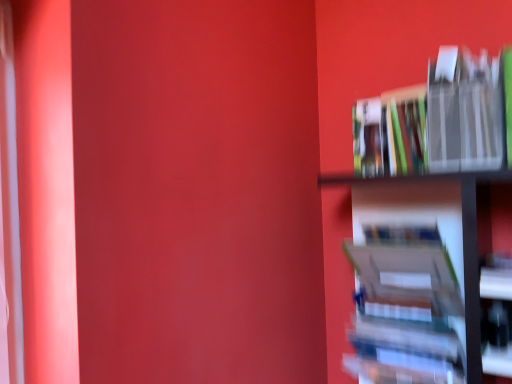
At what (x,y) coordinates should I click in order to perform the action: click on metallic silver book at right, placed as the third book when sorted from bottom to top. Please return your answer as a coordinate pair (x, y). Looking at the image, I should click on (439, 120).

Who is taller, hardcover book at right, which appears as the 1th book when ordered from the bottom, or metallic silver book at right, placed as the third book when sorted from bottom to top?

hardcover book at right, which appears as the 1th book when ordered from the bottom, is taller.

Measure the distance between hardcover book at right, the 3th book from the top, and metallic silver book at right, placed as the third book when sorted from bottom to top.

The distance of hardcover book at right, the 3th book from the top, from metallic silver book at right, placed as the third book when sorted from bottom to top, is 28.44 centimeters.

From a real-world perspective, who is located lower, hardcover book at right, which appears as the 1th book when ordered from the bottom, or metallic silver book at right, acting as the first book starting from the top?

hardcover book at right, which appears as the 1th book when ordered from the bottom, is physically lower.

Considering the points (440, 203) and (362, 142), which point is behind, point (440, 203) or point (362, 142)?

Point (440, 203)

Which book is the 2nd one when counting from the right side of the hardcover book at right, the 3th book from the top? Please provide its 2D coordinates.

[(439, 120)]

Does metallic silver book at right, placed as the third book when sorted from bottom to top, turn towards hardcover book at right, which appears as the 1th book when ordered from the bottom?

No, metallic silver book at right, placed as the third book when sorted from bottom to top, does not turn towards hardcover book at right, which appears as the 1th book when ordered from the bottom.

Does metallic silver book at right, placed as the third book when sorted from bottom to top, have a lesser width compared to hardcover book at right, which appears as the 1th book when ordered from the bottom?

No.

From the image's perspective, which one is positioned lower, hardcover book at right, which appears as the 1th book when ordered from the bottom, or hardcover book at upper right, the 2th book when ordered from bottom to top?

hardcover book at right, which appears as the 1th book when ordered from the bottom, from the image's perspective.

Does point (443, 308) come closer to viewer compared to point (381, 162)?

That is True.

Does hardcover book at right, which appears as the 1th book when ordered from the bottom, contain hardcover book at upper right, placed as the 2th book when sorted from top to bottom?

No, hardcover book at upper right, placed as the 2th book when sorted from top to bottom, is not surrounded by hardcover book at right, which appears as the 1th book when ordered from the bottom.

Relative to hardcover book at upper right, the 2th book when ordered from bottom to top, is hardcover book at right, which appears as the 1th book when ordered from the bottom, in front or behind?

hardcover book at right, which appears as the 1th book when ordered from the bottom, is in front of hardcover book at upper right, the 2th book when ordered from bottom to top.

Considering the relative sizes of hardcover book at upper right, placed as the 2th book when sorted from top to bottom, and hardcover book at right, which appears as the 1th book when ordered from the bottom, in the image provided, is hardcover book at upper right, placed as the 2th book when sorted from top to bottom, wider than hardcover book at right, which appears as the 1th book when ordered from the bottom,?

No, hardcover book at upper right, placed as the 2th book when sorted from top to bottom, is not wider than hardcover book at right, which appears as the 1th book when ordered from the bottom.

Is hardcover book at upper right, placed as the 2th book when sorted from top to bottom, to the left of hardcover book at right, the 3th book from the top, from the viewer's perspective?

No, hardcover book at upper right, placed as the 2th book when sorted from top to bottom, is not to the left of hardcover book at right, the 3th book from the top.

Is hardcover book at upper right, placed as the 2th book when sorted from top to bottom, taller than hardcover book at right, which appears as the 1th book when ordered from the bottom?

Incorrect, the height of hardcover book at upper right, placed as the 2th book when sorted from top to bottom, is not larger of that of hardcover book at right, which appears as the 1th book when ordered from the bottom.

Between hardcover book at upper right, the 2th book when ordered from bottom to top, and hardcover book at right, which appears as the 1th book when ordered from the bottom, which one is positioned in front?

hardcover book at right, which appears as the 1th book when ordered from the bottom, is in front.

From the picture: From a real-world perspective, is hardcover book at upper right, the 2th book when ordered from bottom to top, physically located above or below metallic silver book at right, acting as the first book starting from the top?

hardcover book at upper right, the 2th book when ordered from bottom to top, is situated lower than metallic silver book at right, acting as the first book starting from the top, in the real world.

Is hardcover book at upper right, the 2th book when ordered from bottom to top, outside of metallic silver book at right, acting as the first book starting from the top?

Yes, hardcover book at upper right, the 2th book when ordered from bottom to top, is not within metallic silver book at right, acting as the first book starting from the top.

The height and width of the screenshot is (384, 512). Identify the location of book lying on the right of hardcover book at upper right, placed as the 2th book when sorted from top to bottom. (439, 120).

Considering the relative positions of hardcover book at upper right, placed as the 2th book when sorted from top to bottom, and metallic silver book at right, placed as the third book when sorted from bottom to top, in the image provided, is hardcover book at upper right, placed as the 2th book when sorted from top to bottom, to the right of metallic silver book at right, placed as the third book when sorted from bottom to top, from the viewer's perspective?

In fact, hardcover book at upper right, placed as the 2th book when sorted from top to bottom, is to the left of metallic silver book at right, placed as the third book when sorted from bottom to top.

Which is more to the left, metallic silver book at right, placed as the third book when sorted from bottom to top, or hardcover book at upper right, placed as the 2th book when sorted from top to bottom?

hardcover book at upper right, placed as the 2th book when sorted from top to bottom, is more to the left.

Who is bigger, metallic silver book at right, placed as the third book when sorted from bottom to top, or hardcover book at upper right, placed as the 2th book when sorted from top to bottom?

Bigger between the two is metallic silver book at right, placed as the third book when sorted from bottom to top.

Can hardcover book at upper right, the 2th book when ordered from bottom to top, be found inside metallic silver book at right, placed as the third book when sorted from bottom to top?

Actually, hardcover book at upper right, the 2th book when ordered from bottom to top, is outside metallic silver book at right, placed as the third book when sorted from bottom to top.

Is metallic silver book at right, placed as the third book when sorted from bottom to top, wider than hardcover book at upper right, placed as the 2th book when sorted from top to bottom?

Yes.

From a real-world perspective, which book is the 2nd one underneath the metallic silver book at right, acting as the first book starting from the top? Please provide its 2D coordinates.

[(413, 282)]

Identify the location of the 1st book behind the metallic silver book at right, acting as the first book starting from the top, starting your count from the anchor. (413, 282).

Considering their positions, is hardcover book at upper right, the 2th book when ordered from bottom to top, positioned further to hardcover book at right, which appears as the 1th book when ordered from the bottom, than metallic silver book at right, acting as the first book starting from the top?

hardcover book at upper right, the 2th book when ordered from bottom to top, lies further to hardcover book at right, which appears as the 1th book when ordered from the bottom, than the other object.

Consider the image. Based on their spatial positions, is hardcover book at upper right, the 2th book when ordered from bottom to top, or hardcover book at right, which appears as the 1th book when ordered from the bottom, further from metallic silver book at right, placed as the third book when sorted from bottom to top?

hardcover book at right, which appears as the 1th book when ordered from the bottom, is further to metallic silver book at right, placed as the third book when sorted from bottom to top.

Looking at the image, which one is located closer to hardcover book at upper right, placed as the 2th book when sorted from top to bottom, hardcover book at right, which appears as the 1th book when ordered from the bottom, or metallic silver book at right, acting as the first book starting from the top?

Among the two, metallic silver book at right, acting as the first book starting from the top, is located nearer to hardcover book at upper right, placed as the 2th book when sorted from top to bottom.

Considering their positions, is hardcover book at right, which appears as the 1th book when ordered from the bottom, positioned further to metallic silver book at right, acting as the first book starting from the top, than hardcover book at upper right, placed as the 2th book when sorted from top to bottom?

hardcover book at right, which appears as the 1th book when ordered from the bottom, lies further to metallic silver book at right, acting as the first book starting from the top, than the other object.

Estimate the real-world distances between objects in this image. Which object is further from hardcover book at right, which appears as the 1th book when ordered from the bottom, metallic silver book at right, acting as the first book starting from the top, or hardcover book at upper right, the 2th book when ordered from bottom to top?

hardcover book at upper right, the 2th book when ordered from bottom to top.

Considering their positions, is metallic silver book at right, acting as the first book starting from the top, positioned further to hardcover book at upper right, the 2th book when ordered from bottom to top, than hardcover book at right, the 3th book from the top?

hardcover book at right, the 3th book from the top, is further to hardcover book at upper right, the 2th book when ordered from bottom to top.

At what (x,y) coordinates should I click in order to perform the action: click on book between metallic silver book at right, acting as the first book starting from the top, and hardcover book at right, which appears as the 1th book when ordered from the bottom, in the up-down direction. Please return your answer as a coordinate pair (x, y). Image resolution: width=512 pixels, height=384 pixels. Looking at the image, I should click on (390, 133).